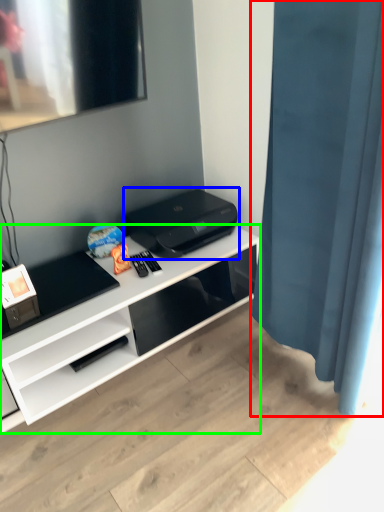
Question: Which is farther away from shower curtain (highlighted by a red box)? printer (highlighted by a blue box) or desk (highlighted by a green box)?

Choices:
 (A) printer
 (B) desk

Answer: (B)